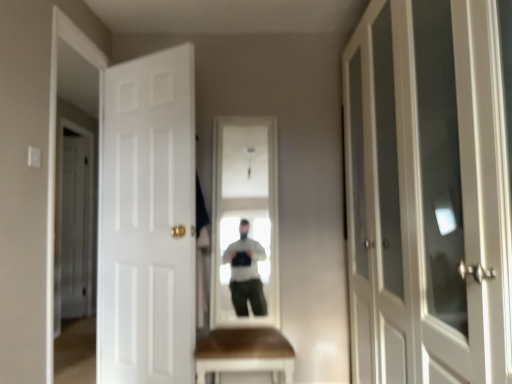
Question: Is white wood door at left, the third door in the front-to-back sequence, thinner than white glass cabinet at right, the 3th door from the left?

Choices:
 (A) no
 (B) yes

Answer: (B)

Question: From a real-world perspective, is white wood door at left, the first door when ordered from left to right, physically below white glass cabinet at right, the 3th door from the left?

Choices:
 (A) yes
 (B) no

Answer: (A)

Question: From a real-world perspective, is white wood door at left, arranged as the first door when viewed from the back, located higher than white glass cabinet at right, marked as the first door in a front-to-back arrangement?

Choices:
 (A) yes
 (B) no

Answer: (B)

Question: Is white wood door at left, the first door when ordered from left to right, surrounding white glass cabinet at right, the 3th door positioned from the back?

Choices:
 (A) no
 (B) yes

Answer: (A)

Question: Considering the relative sizes of white wood door at left, arranged as the 3th door when viewed from the right, and white glass cabinet at right, which is counted as the 1th door, starting from the right, in the image provided, is white wood door at left, arranged as the 3th door when viewed from the right, shorter than white glass cabinet at right, which is counted as the 1th door, starting from the right,?

Choices:
 (A) yes
 (B) no

Answer: (B)

Question: From a real-world perspective, is white matte door at left, placed as the 2th door when sorted from back to front, physically located above or below white wood door at left, arranged as the first door when viewed from the back?

Choices:
 (A) below
 (B) above

Answer: (B)

Question: From the image's perspective, is white matte door at left, which ranks as the 2th door in front-to-back order, above or below white wood door at left, the first door when ordered from left to right?

Choices:
 (A) above
 (B) below

Answer: (A)

Question: Which is correct: white matte door at left, placed as the 2th door when sorted from back to front, is inside white wood door at left, the third door in the front-to-back sequence, or outside of it?

Choices:
 (A) inside
 (B) outside

Answer: (B)

Question: Would you say white matte door at left, which is the 2th door from left to right, is to the left or to the right of white wood door at left, the first door when ordered from left to right, in the picture?

Choices:
 (A) left
 (B) right

Answer: (B)

Question: Is point (398, 342) closer or farther from the camera than point (61, 243)?

Choices:
 (A) farther
 (B) closer

Answer: (B)

Question: Is white glass cabinet at right, the 3th door positioned from the back, inside or outside of white wood door at left, the first door when ordered from left to right?

Choices:
 (A) outside
 (B) inside

Answer: (A)

Question: Would you say white glass cabinet at right, the 3th door from the left, is to the left or to the right of white wood door at left, arranged as the first door when viewed from the back, in the picture?

Choices:
 (A) left
 (B) right

Answer: (B)

Question: Considering their positions, is white glass cabinet at right, which is counted as the 1th door, starting from the right, located in front of or behind white wood door at left, the third door in the front-to-back sequence?

Choices:
 (A) behind
 (B) front

Answer: (B)

Question: Is white glass cabinet at right, marked as the first door in a front-to-back arrangement, inside the boundaries of white matte door at left, which is the 2th door from left to right, or outside?

Choices:
 (A) inside
 (B) outside

Answer: (B)

Question: From the image's perspective, relative to white matte door at left, which ranks as the 2th door in front-to-back order, is white glass cabinet at right, which is counted as the 1th door, starting from the right, above or below?

Choices:
 (A) above
 (B) below

Answer: (A)